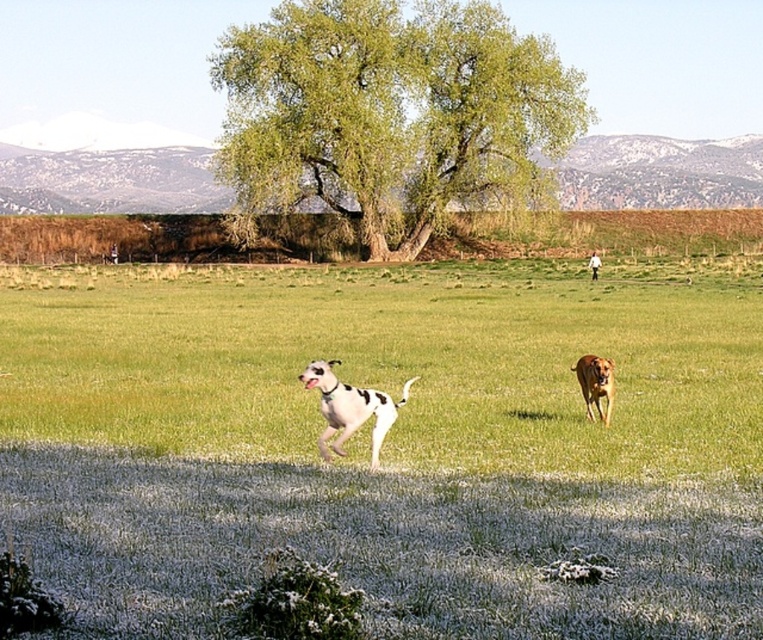
Question: Which object is the closest to the green grass at center?

Choices:
 (A) white-spotted fur dog at center
 (B) golden brown fur at right
 (C) green leafy tree at center

Answer: (C)

Question: Which point appears closest to the camera in this image?

Choices:
 (A) (374, 467)
 (B) (452, 378)
 (C) (597, 358)

Answer: (A)

Question: Can you confirm if white-spotted fur dog at center is positioned above golden brown fur at right?

Choices:
 (A) no
 (B) yes

Answer: (A)

Question: Which point appears farthest from the camera in this image?

Choices:
 (A) (322, 387)
 (B) (89, 300)
 (C) (609, 365)
 (D) (436, 4)

Answer: (D)

Question: Is green leafy tree at center smaller than golden brown fur at right?

Choices:
 (A) yes
 (B) no

Answer: (B)

Question: From the image, what is the correct spatial relationship of green leafy tree at center in relation to white-spotted fur dog at center?

Choices:
 (A) above
 (B) below

Answer: (A)